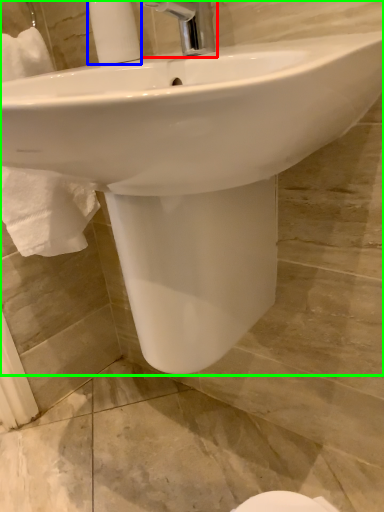
Question: Based on their relative distances, which object is farther from tap (highlighted by a red box)? Choose from soap dispenser (highlighted by a blue box) and sink (highlighted by a green box).

Choices:
 (A) soap dispenser
 (B) sink

Answer: (B)